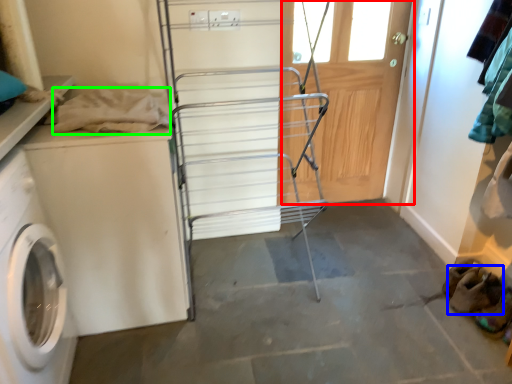
Question: Estimate the real-world distances between objects in this image. Which object is farther from screen door (highlighted by a red box), shoe (highlighted by a blue box) or clothing (highlighted by a green box)?

Choices:
 (A) shoe
 (B) clothing

Answer: (B)